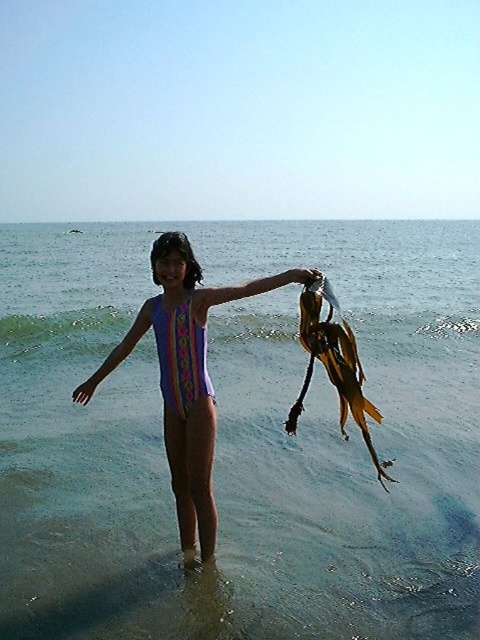
Question: Does clear water at center come behind purple matte swimsuit at center?

Choices:
 (A) no
 (B) yes

Answer: (B)

Question: Is clear water at center to the left of purple matte swimsuit at center from the viewer's perspective?

Choices:
 (A) yes
 (B) no

Answer: (A)

Question: Is clear water at center wider than purple matte swimsuit at center?

Choices:
 (A) no
 (B) yes

Answer: (B)

Question: Which point is farther from the camera taking this photo?

Choices:
 (A) (382, 292)
 (B) (140, 317)

Answer: (A)

Question: Which point appears farthest from the camera in this image?

Choices:
 (A) (104, 360)
 (B) (107, 481)

Answer: (A)